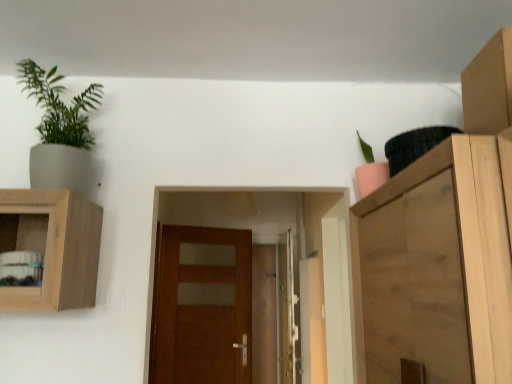
Find the location of `cardboard box at upper right`. cardboard box at upper right is located at coordinates (x=489, y=87).

At what (x,y) coordinates should I click in order to perform the action: click on brown wooden door at center, the 2th door viewed from the back. Please return your answer as a coordinate pair (x, y). This screenshot has height=384, width=512. Looking at the image, I should click on (203, 312).

This screenshot has height=384, width=512. Describe the element at coordinates (370, 171) in the screenshot. I see `pink matte pot at upper right, the 2th houseplant when ordered from left to right` at that location.

Image resolution: width=512 pixels, height=384 pixels. In order to click on cardboard box at upper right in this screenshot , I will do `click(489, 87)`.

Considering the relative sizes of metallic silver screen door at center and brown wooden door at center, positioned as the 2th door in front-to-back order, in the image provided, is metallic silver screen door at center smaller than brown wooden door at center, positioned as the 2th door in front-to-back order,?

Yes, metallic silver screen door at center is smaller than brown wooden door at center, positioned as the 2th door in front-to-back order.

Can you see metallic silver screen door at center touching brown wooden door at center, which appears as the 1th door when viewed from the back?

No, metallic silver screen door at center is not touching brown wooden door at center, which appears as the 1th door when viewed from the back.

Which object is closer to the camera, metallic silver screen door at center or brown wooden door at center, positioned as the 2th door in front-to-back order?

metallic silver screen door at center is in front.

Is metallic silver screen door at center completely or partially outside of brown wooden door at center, positioned as the 2th door in front-to-back order?

Yes.

Where is `screen door lying behind the pink matte pot at upper right, the 2th houseplant when ordered from left to right`? Image resolution: width=512 pixels, height=384 pixels. screen door lying behind the pink matte pot at upper right, the 2th houseplant when ordered from left to right is located at coordinates (288, 311).

In terms of height, does metallic silver screen door at center look taller or shorter compared to pink matte pot at upper right, the first houseplant viewed from the right?

In the image, metallic silver screen door at center appears to be taller than pink matte pot at upper right, the first houseplant viewed from the right.

Can you confirm if metallic silver screen door at center is positioned to the left of pink matte pot at upper right, the 2th houseplant when ordered from left to right?

Indeed, metallic silver screen door at center is positioned on the left side of pink matte pot at upper right, the 2th houseplant when ordered from left to right.

Is metallic silver screen door at center not inside pink matte pot at upper right, the 2th houseplant when ordered from left to right?

Indeed, metallic silver screen door at center is completely outside pink matte pot at upper right, the 2th houseplant when ordered from left to right.

Is wooden cabinet at right to the right of matte gray pot at upper left, marked as the first houseplant in a left-to-right arrangement, from the viewer's perspective?

Yes.

Is wooden cabinet at right touching matte gray pot at upper left, marked as the first houseplant in a left-to-right arrangement?

No, wooden cabinet at right is not making contact with matte gray pot at upper left, marked as the first houseplant in a left-to-right arrangement.

Can you confirm if wooden cabinet at right is bigger than matte gray pot at upper left, the second houseplant from the right?

Correct, wooden cabinet at right is larger in size than matte gray pot at upper left, the second houseplant from the right.

Is matte gray pot at upper left, marked as the first houseplant in a left-to-right arrangement, with metallic silver screen door at center?

No, matte gray pot at upper left, marked as the first houseplant in a left-to-right arrangement, is not in contact with metallic silver screen door at center.

From a real-world perspective, which is physically below, matte gray pot at upper left, the second houseplant from the right, or metallic silver screen door at center?

metallic silver screen door at center.

Would you say matte gray pot at upper left, marked as the first houseplant in a left-to-right arrangement, is outside metallic silver screen door at center?

Yes.

Is point (45, 97) closer to camera compared to point (289, 325)?

Yes.

Does brown wooden door at center, which ranks as the 1th door in front-to-back order, have a greater width compared to metallic silver screen door at center?

In fact, brown wooden door at center, which ranks as the 1th door in front-to-back order, might be narrower than metallic silver screen door at center.

Relative to metallic silver screen door at center, is brown wooden door at center, which ranks as the 1th door in front-to-back order, in front or behind?

Visually, brown wooden door at center, which ranks as the 1th door in front-to-back order, is located behind metallic silver screen door at center.

Based on the photo, between brown wooden door at center, the 2th door viewed from the back, and metallic silver screen door at center, which one appears on the right side from the viewer's perspective?

metallic silver screen door at center.

From a real-world perspective, which object stands above the other?

From a 3D spatial view, brown wooden door at center, the 2th door viewed from the back, is above.

Does point (507, 65) lie behind point (378, 186)?

No.

Is cardboard box at upper right further to camera compared to pink matte pot at upper right, the 2th houseplant when ordered from left to right?

No, cardboard box at upper right is in front of pink matte pot at upper right, the 2th houseplant when ordered from left to right.

Can you confirm if cardboard box at upper right is shorter than pink matte pot at upper right, the 2th houseplant when ordered from left to right?

Yes.

The height and width of the screenshot is (384, 512). Find the location of `cardboard box that appears above the pink matte pot at upper right, the 2th houseplant when ordered from left to right (from a real-world perspective)`. cardboard box that appears above the pink matte pot at upper right, the 2th houseplant when ordered from left to right (from a real-world perspective) is located at coordinates (489, 87).

Which is in front, pink matte pot at upper right, the first houseplant viewed from the right, or matte gray pot at upper left, the second houseplant from the right?

matte gray pot at upper left, the second houseplant from the right, is more forward.

From the image's perspective, is pink matte pot at upper right, the 2th houseplant when ordered from left to right, above or below matte gray pot at upper left, marked as the first houseplant in a left-to-right arrangement?

From the image's perspective, pink matte pot at upper right, the 2th houseplant when ordered from left to right, appears below matte gray pot at upper left, marked as the first houseplant in a left-to-right arrangement.

Would you say matte gray pot at upper left, marked as the first houseplant in a left-to-right arrangement, is part of pink matte pot at upper right, the 2th houseplant when ordered from left to right,'s contents?

No.

The width and height of the screenshot is (512, 384). I want to click on houseplant in front of the pink matte pot at upper right, the 2th houseplant when ordered from left to right, so click(x=59, y=130).

Locate an element on the screen. The width and height of the screenshot is (512, 384). screen door on the right of brown wooden door at center, which appears as the 1th door when viewed from the back is located at coordinates (288, 311).

Image resolution: width=512 pixels, height=384 pixels. I want to click on screen door that appears below the pink matte pot at upper right, the 2th houseplant when ordered from left to right (from a real-world perspective), so click(288, 311).

Based on their spatial positions, is cardboard box at upper right or brown wooden door at center, which appears as the 1th door when viewed from the back, closer to matte gray pot at upper left, the second houseplant from the right?

Among the two, cardboard box at upper right is located nearer to matte gray pot at upper left, the second houseplant from the right.

Looking at the image, which one is located further to brown wooden door at center, positioned as the 2th door in front-to-back order, pink matte pot at upper right, the 2th houseplant when ordered from left to right, or brown wooden door at center, which ranks as the 1th door in front-to-back order?

pink matte pot at upper right, the 2th houseplant when ordered from left to right.

Estimate the real-world distances between objects in this image. Which object is further from matte gray pot at upper left, marked as the first houseplant in a left-to-right arrangement, brown wooden door at center, which ranks as the 1th door in front-to-back order, or wooden cabinet at right?

brown wooden door at center, which ranks as the 1th door in front-to-back order, lies further to matte gray pot at upper left, marked as the first houseplant in a left-to-right arrangement, than the other object.

From the image, which object appears to be farther from wooden cabinet at right, metallic silver screen door at center or brown wooden door at center, which ranks as the 1th door in front-to-back order?

metallic silver screen door at center is positioned further to the anchor wooden cabinet at right.

Which object lies further to the anchor point cardboard box at upper right, matte gray pot at upper left, the second houseplant from the right, or metallic silver screen door at center?

metallic silver screen door at center is positioned further to the anchor cardboard box at upper right.

When comparing their distances from wooden cabinet at right, does pink matte pot at upper right, the first houseplant viewed from the right, or brown wooden door at center, positioned as the 2th door in front-to-back order, seem closer?

pink matte pot at upper right, the first houseplant viewed from the right.

From the image, which object appears to be nearer to pink matte pot at upper right, the 2th houseplant when ordered from left to right, brown wooden door at center, which appears as the 1th door when viewed from the back, or brown wooden door at center, which ranks as the 1th door in front-to-back order?

brown wooden door at center, which ranks as the 1th door in front-to-back order, lies closer to pink matte pot at upper right, the 2th houseplant when ordered from left to right, than the other object.

From the image, which object appears to be farther from brown wooden door at center, which ranks as the 1th door in front-to-back order, brown wooden door at center, positioned as the 2th door in front-to-back order, or cardboard box at upper right?

cardboard box at upper right lies further to brown wooden door at center, which ranks as the 1th door in front-to-back order, than the other object.

Locate an element on the screen. Image resolution: width=512 pixels, height=384 pixels. screen door between matte gray pot at upper left, marked as the first houseplant in a left-to-right arrangement, and brown wooden door at center, which ranks as the 1th door in front-to-back order, along the z-axis is located at coordinates (288, 311).

Identify the location of houseplant between matte gray pot at upper left, marked as the first houseplant in a left-to-right arrangement, and brown wooden door at center, which appears as the 1th door when viewed from the back, from front to back. The width and height of the screenshot is (512, 384). (370, 171).

Identify the location of screen door between pink matte pot at upper right, the first houseplant viewed from the right, and brown wooden door at center, which appears as the 1th door when viewed from the back, in the front-back direction. This screenshot has height=384, width=512. (288, 311).

The height and width of the screenshot is (384, 512). Identify the location of cardboard box between wooden cabinet at right and pink matte pot at upper right, the first houseplant viewed from the right, in the front-back direction. (489, 87).